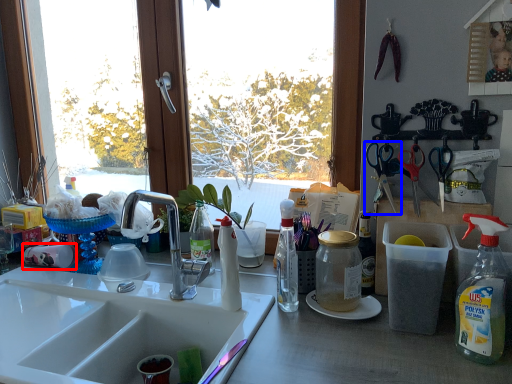
Question: Among these objects, which one is nearest to the camera, coffee cup (highlighted by a red box) or scissors (highlighted by a blue box)?

Choices:
 (A) coffee cup
 (B) scissors

Answer: (B)